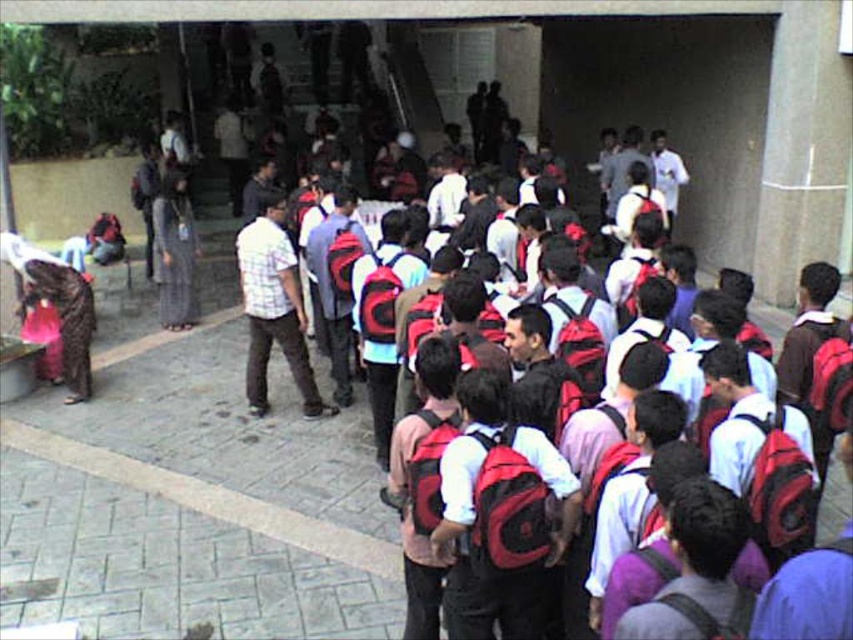
You are standing at the entrance of the building and want to get to the plaid shirt at center. Is the gray concrete line at lower center blocking your path?

The gray concrete line at lower center is in front of the plaid shirt at center, so it is blocking your path.

You are standing in front of the building and want to pick up the matte red backpack at center and the plaid shirt at center. Which item should you reach for first based on their positions?

The matte red backpack at center is closer to you than the plaid shirt at center, so you should reach for the matte red backpack at center first.